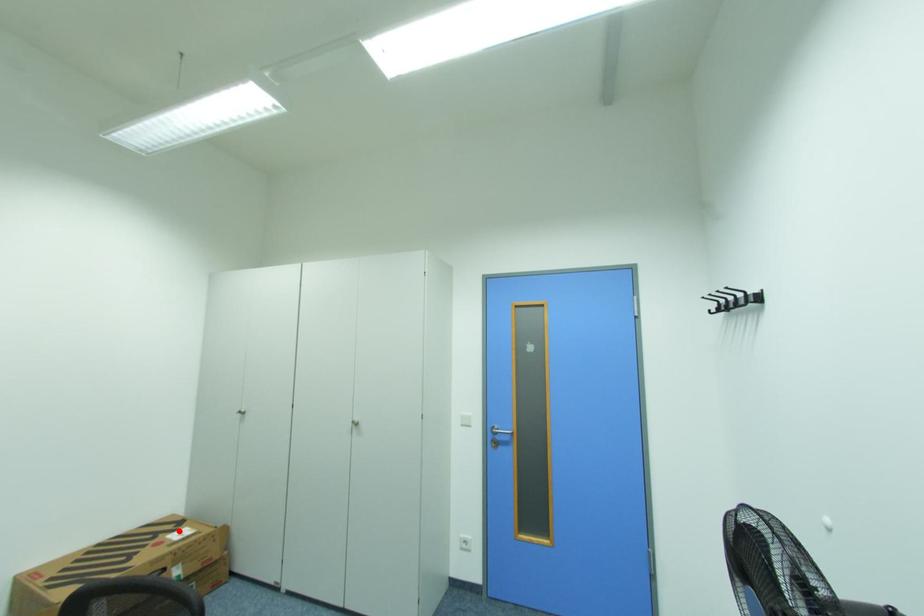
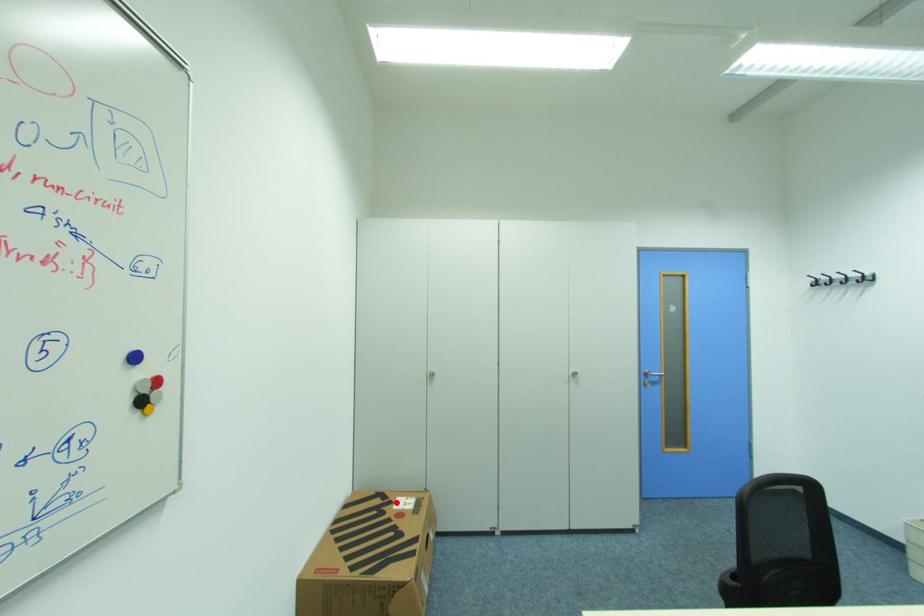
I am providing you with two images of the same scene from different viewpoints. A red point is marked on the first image and another point is marked on the second image. Is the marked point in image1 the same physical position as the marked point in image2?

Yes